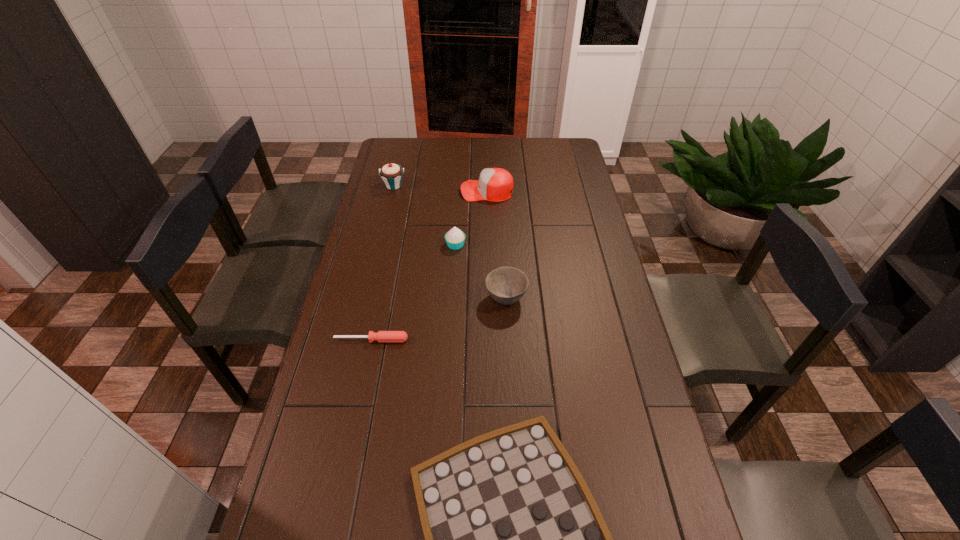
This screenshot has height=540, width=960. Identify the location of vacant position located 0.330m on the front-facing side of the baseball cap. (384, 191).

This screenshot has width=960, height=540. I want to click on free space located on the front-facing side of the baseball cap, so click(x=430, y=191).

Where is `vacant position located on the right of the nearer cupcake`? vacant position located on the right of the nearer cupcake is located at coordinates (532, 245).

The width and height of the screenshot is (960, 540). Identify the location of free space located 0.330m on the left of the bowl. (387, 298).

Locate an element on the screen. This screenshot has height=540, width=960. free space located 0.060m on the right of the screwdriver is located at coordinates (427, 340).

The height and width of the screenshot is (540, 960). What are the coordinates of `cupcake located in the left edge section of the desktop` in the screenshot? It's located at 391,174.

Identify the location of screwdriver that is at the left edge. Image resolution: width=960 pixels, height=540 pixels. (382, 336).

This screenshot has width=960, height=540. I want to click on vacant space at the far edge of the desktop, so click(533, 152).

In order to click on vacant region at the left edge of the desktop in this screenshot , I will do `click(364, 251)`.

Find the location of `vacant space at the right edge of the desktop`. vacant space at the right edge of the desktop is located at coordinates (659, 477).